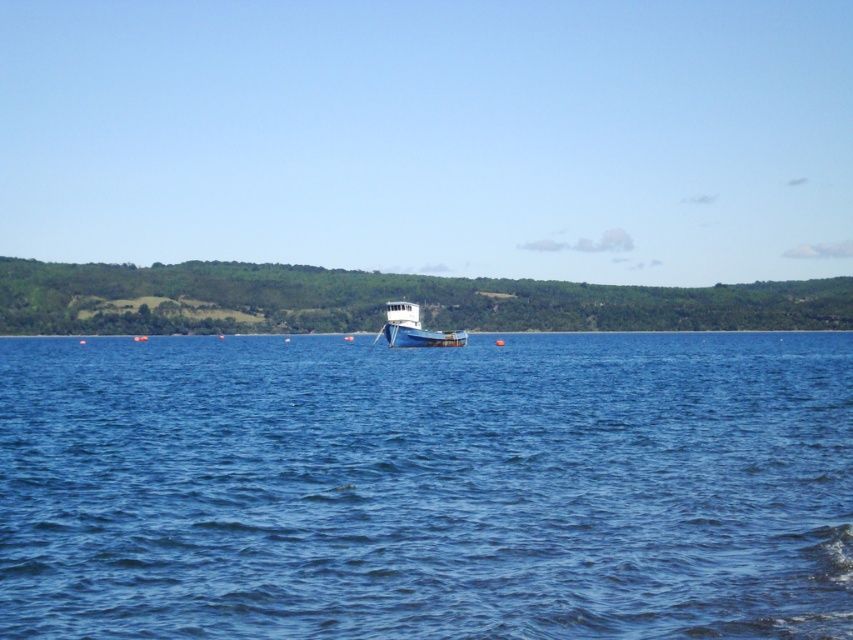
Can you confirm if blue water at center is positioned to the left of blue wooden boat at center?

No, blue water at center is not to the left of blue wooden boat at center.

Between point (851, 490) and point (418, 337), which one is positioned behind?

Positioned behind is point (418, 337).

The image size is (853, 640). What are the coordinates of `blue water at center` in the screenshot? It's located at coord(427,486).